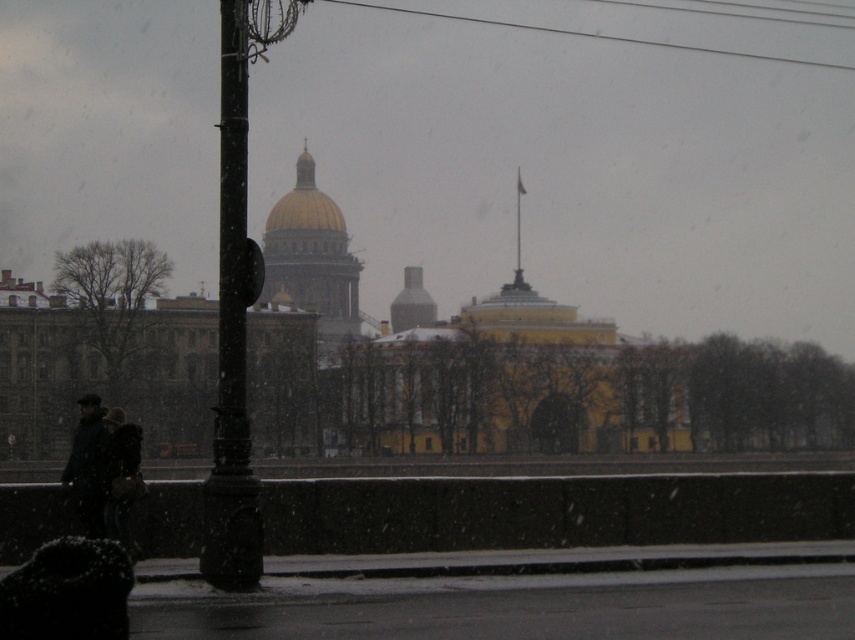
Who is positioned more to the right, black metal pole at left or dark wool coat at lower left?

dark wool coat at lower left

You are a GUI agent. You are given a task and a screenshot of the screen. Output one action in this format:
    pyautogui.click(x=<x>, y=<y>)
    Task: Click on the black metal pole at left
    
    Given the screenshot: What is the action you would take?
    pyautogui.click(x=233, y=339)

Between point (242, 228) and point (121, 522), which one is positioned in front?

Point (242, 228) is in front.

Does black metal pole at left have a lesser height compared to dark gray coat at left?

Incorrect, black metal pole at left's height does not fall short of dark gray coat at left's.

What are the coordinates of `black metal pole at left` in the screenshot? It's located at (233, 339).

You are a GUI agent. You are given a task and a screenshot of the screen. Output one action in this format:
    pyautogui.click(x=<x>, y=<y>)
    Task: Click on the black metal pole at left
    This screenshot has width=855, height=640.
    Given the screenshot: What is the action you would take?
    pyautogui.click(x=233, y=339)

Does dark wool coat at lower left lie in front of dark gray coat at left?

No, dark wool coat at lower left is further to the viewer.

Between point (77, 403) and point (124, 476), which one is positioned behind?

Point (77, 403)

Locate an element on the screen. dark wool coat at lower left is located at coordinates (104, 470).

Locate an element on the screen. dark wool coat at lower left is located at coordinates (104, 470).